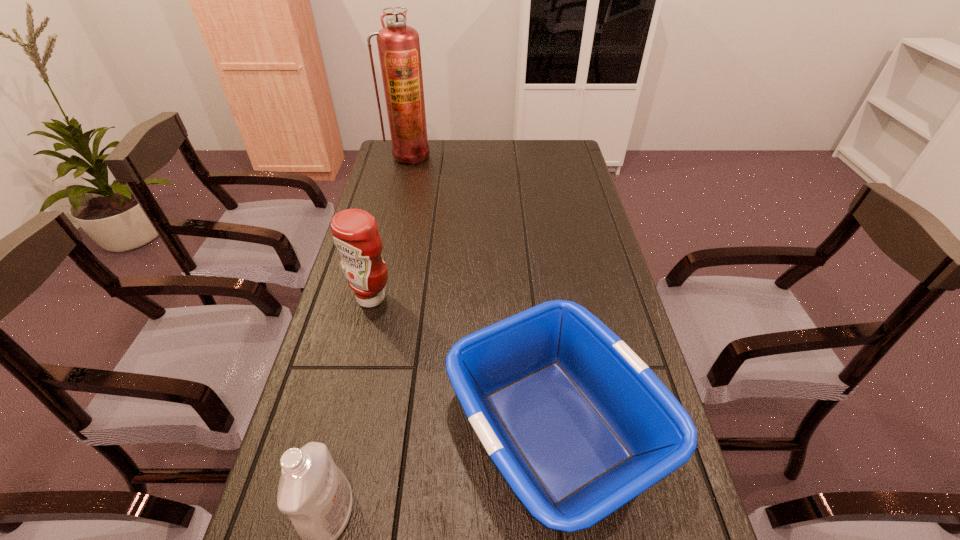
Identify the location of the farthest object. (398, 44).

The width and height of the screenshot is (960, 540). What are the coordinates of `the tallest object` in the screenshot? It's located at click(398, 44).

This screenshot has width=960, height=540. I want to click on the second farthest object, so click(x=355, y=233).

Identify the location of vacant space located on the side of the fire extinguisher with the label. (404, 176).

I want to click on blank space located on the front of the condiment, so click(x=336, y=441).

Image resolution: width=960 pixels, height=540 pixels. In order to click on object present at the far edge in this screenshot , I will do `click(398, 44)`.

Find the location of a particular element. The width and height of the screenshot is (960, 540). fire extinguisher that is at the left edge is located at coordinates (398, 44).

The image size is (960, 540). Find the location of `condiment that is positioned at the left edge`. condiment that is positioned at the left edge is located at coordinates (355, 233).

Where is `object positioned at the far left corner`? object positioned at the far left corner is located at coordinates (398, 44).

In the image, there is a desktop. Where is `free space at the far edge`? This screenshot has height=540, width=960. free space at the far edge is located at coordinates (457, 152).